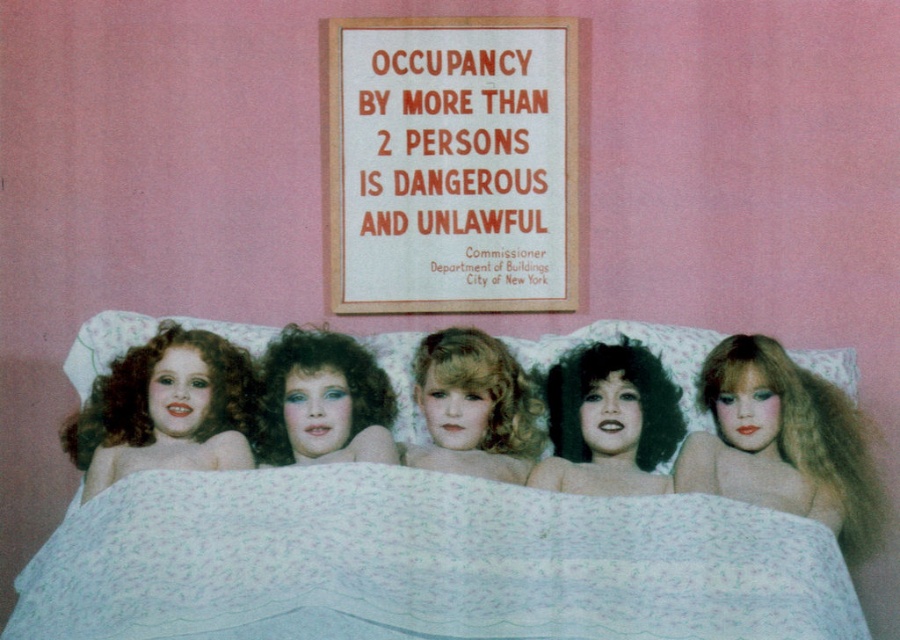
In the scene shown: Is white floral fabric pillow at center wider than curly dark brown hair at center?

Indeed, white floral fabric pillow at center has a greater width compared to curly dark brown hair at center.

Between point (259, 328) and point (614, 369), which one is positioned behind?

Positioned behind is point (259, 328).

Between point (837, 353) and point (645, 417), which one is positioned behind?

Positioned behind is point (837, 353).

Image resolution: width=900 pixels, height=640 pixels. Find the location of `white floral fabric pillow at center`. white floral fabric pillow at center is located at coordinates (639, 342).

Between blonde curly hair at center and curly dark brown hair at center, which one appears on the left side from the viewer's perspective?

blonde curly hair at center is more to the left.

From the picture: Who is more distant from viewer, (435, 356) or (572, 388)?

Point (572, 388)

Identify the location of blonde curly hair at center. (482, 388).

Which is more to the left, white floral fabric pillow at center or blonde curly hair at center?

blonde curly hair at center

Who is more distant from viewer, (140,316) or (465,364)?

Positioned behind is point (140,316).

What do you see at coordinates (639, 342) in the screenshot? This screenshot has width=900, height=640. I see `white floral fabric pillow at center` at bounding box center [639, 342].

The image size is (900, 640). What are the coordinates of `white floral fabric pillow at center` in the screenshot? It's located at (639, 342).